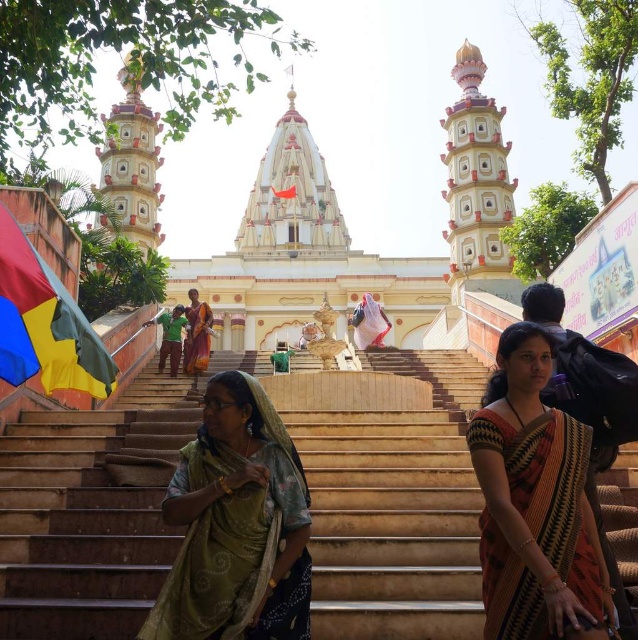
You are a visitor standing at the entrance of the temple complex. You notice the multicolored fabric flag at left and the white painted stone tower at upper center. Which object is positioned lower in the scene?

The multicolored fabric flag at left is positioned below the white painted stone tower at upper center, so it is lower in the scene.

You are a visitor standing at the entrance of the temple complex. You notice the matte cream tower at upper left and the green fabric at center. Which object is closer to you?

The matte cream tower at upper left is closer to you since it is in front of the green fabric at center.

You are a drone operator tasked with capturing aerial footage of the temple complex. Your drone has a maximum flight range of 200 feet from its starting position. If you position the drone at the matte cream tower at upper left, will it be able to reach the red fabric flag at center without exceeding its range?

The distance between the matte cream tower at upper left and the red fabric flag at center is 222.40 feet, which exceeds the drone maximum flight range of 200 feet. Therefore, the drone cannot reach the red fabric flag at center from the matte cream tower at upper left without exceeding its range.